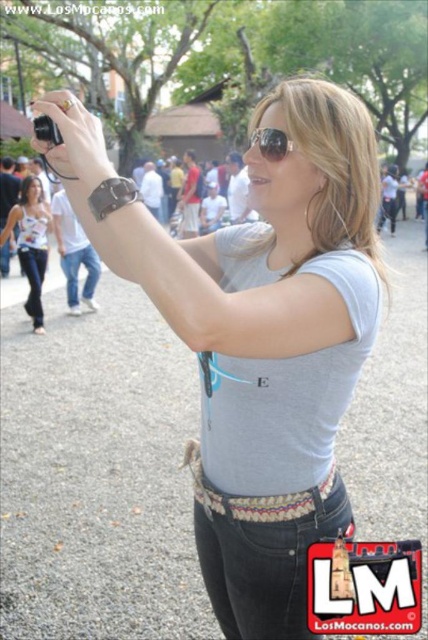
Question: Does jeans at center have a lesser width compared to denim jeans at center?

Choices:
 (A) no
 (B) yes

Answer: (B)

Question: Which point is closer to the camera taking this photo?

Choices:
 (A) pyautogui.click(x=65, y=177)
 (B) pyautogui.click(x=15, y=216)
 (C) pyautogui.click(x=77, y=253)
 (D) pyautogui.click(x=344, y=531)

Answer: (D)

Question: Is denim jeans at center thinner than denim jeans at lower left?

Choices:
 (A) no
 (B) yes

Answer: (A)

Question: Which point appears farthest from the camera in this image?

Choices:
 (A) (282, 563)
 (B) (41, 278)
 (C) (89, 259)

Answer: (C)

Question: Is jeans at center wider than matte black camera at upper left?

Choices:
 (A) no
 (B) yes

Answer: (A)

Question: Which point is farther to the camera?

Choices:
 (A) (65, 275)
 (B) (41, 100)

Answer: (A)